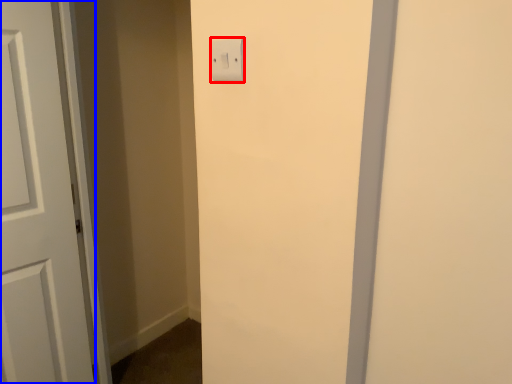
Question: Which of the following is the closest to the observer, light switch (highlighted by a red box) or door (highlighted by a blue box)?

Choices:
 (A) light switch
 (B) door

Answer: (A)